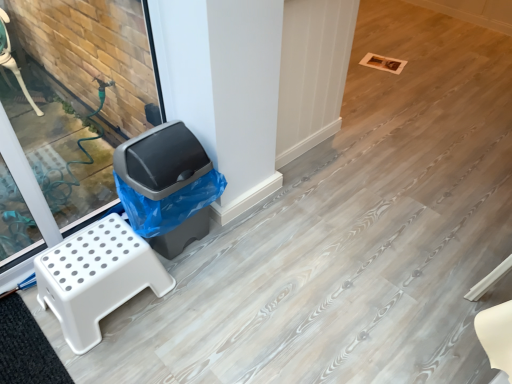
In order to click on vacant area that lies between gray plastic trash can at left and white plastic step stool at left in this screenshot , I will do `click(192, 260)`.